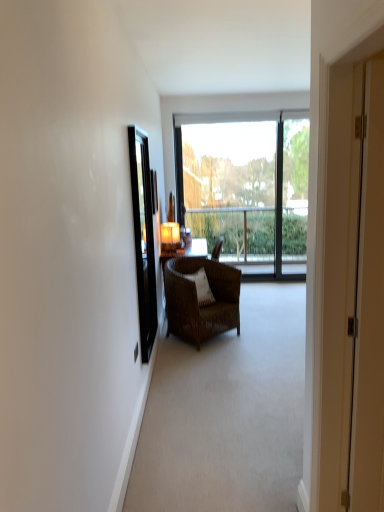
Question: Is black glass screen door at left, which appears as the second screen door when viewed from the front, facing away from matte glass lampshade at upper center?

Choices:
 (A) no
 (B) yes

Answer: (A)

Question: Is black glass screen door at left, which appears as the second screen door when viewed from the front, facing towards matte glass lampshade at upper center?

Choices:
 (A) no
 (B) yes

Answer: (A)

Question: From the image's perspective, is black glass screen door at left, the 2th screen door viewed from the right, on matte glass lampshade at upper center?

Choices:
 (A) yes
 (B) no

Answer: (B)

Question: Is black glass screen door at left, placed as the first screen door when sorted from back to front, positioned in front of matte glass lampshade at upper center?

Choices:
 (A) yes
 (B) no

Answer: (A)

Question: From the image's perspective, is black glass screen door at left, the 2th screen door viewed from the right, under matte glass lampshade at upper center?

Choices:
 (A) yes
 (B) no

Answer: (A)

Question: Based on their positions, is brown wicker chair at center located to the left or right of white wood screen door at right, the 2th screen door in the left-to-right sequence?

Choices:
 (A) right
 (B) left

Answer: (B)

Question: Is point [185, 272] positioned closer to the camera than point [334, 467]?

Choices:
 (A) farther
 (B) closer

Answer: (A)

Question: Is brown wicker chair at center inside the boundaries of white wood screen door at right, the second screen door when ordered from back to front, or outside?

Choices:
 (A) inside
 (B) outside

Answer: (B)

Question: Is brown wicker chair at center in front of or behind white wood screen door at right, the second screen door when ordered from back to front, in the image?

Choices:
 (A) behind
 (B) front

Answer: (A)

Question: Is point (150, 329) closer or farther from the camera than point (350, 173)?

Choices:
 (A) closer
 (B) farther

Answer: (B)

Question: Is black glass screen door at left, which is the first screen door in left-to-right order, taller or shorter than white wood screen door at right, the second screen door when ordered from back to front?

Choices:
 (A) short
 (B) tall

Answer: (A)

Question: Would you say black glass screen door at left, the 2th screen door viewed from the right, is inside or outside white wood screen door at right, the second screen door when ordered from back to front?

Choices:
 (A) outside
 (B) inside

Answer: (A)

Question: Is black glass screen door at left, which appears as the second screen door when viewed from the front, bigger or smaller than white wood screen door at right, the second screen door when ordered from back to front?

Choices:
 (A) small
 (B) big

Answer: (A)

Question: Considering the positions of point (139, 320) and point (196, 297), is point (139, 320) closer or farther from the camera than point (196, 297)?

Choices:
 (A) farther
 (B) closer

Answer: (B)

Question: From the image's perspective, is black glass screen door at left, the 2th screen door viewed from the right, located above or below white textured pillow at center?

Choices:
 (A) below
 (B) above

Answer: (B)